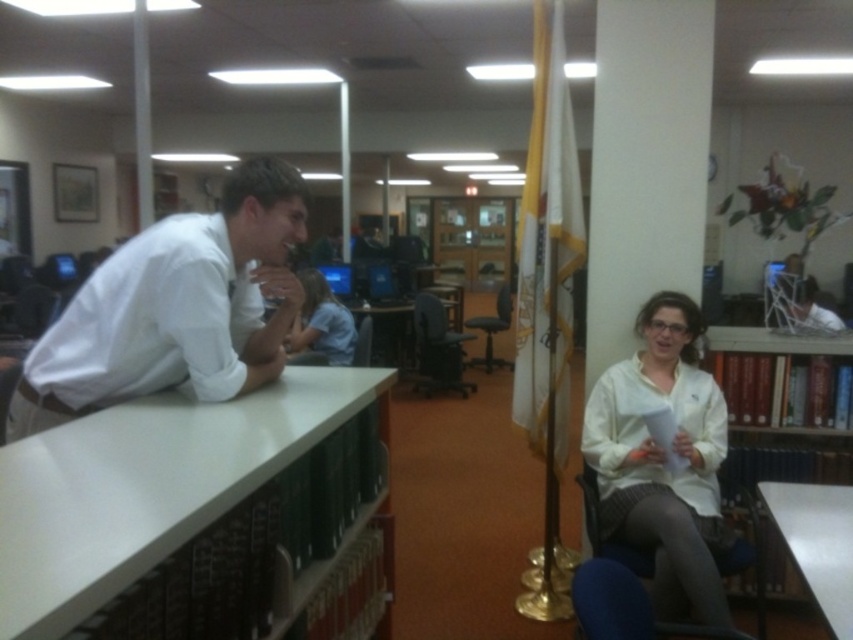
Locate an element on the screen. The width and height of the screenshot is (853, 640). white glossy table at lower right is located at coordinates (817, 544).

Describe the element at coordinates (817, 544) in the screenshot. The height and width of the screenshot is (640, 853). I see `white glossy table at lower right` at that location.

The image size is (853, 640). What do you see at coordinates (817, 544) in the screenshot?
I see `white glossy table at lower right` at bounding box center [817, 544].

Locate an element on the screen. white glossy table at lower right is located at coordinates (817, 544).

Where is `white glossy table at left`? white glossy table at left is located at coordinates pyautogui.click(x=146, y=486).

Is white glossy table at left above white smooth shirt at left?

No.

The height and width of the screenshot is (640, 853). I want to click on white glossy table at left, so click(146, 486).

Locate an element on the screen. This screenshot has height=640, width=853. white glossy table at left is located at coordinates (146, 486).

Consider the image. Who is higher up, white smooth shirt at left or white glossy table at lower right?

Positioned higher is white smooth shirt at left.

Looking at this image, measure the distance between white smooth shirt at left and white glossy table at lower right.

white smooth shirt at left and white glossy table at lower right are 1.48 meters apart from each other.

Is point (154, 312) closer to camera compared to point (830, 490)?

Yes.

You are a GUI agent. You are given a task and a screenshot of the screen. Output one action in this format:
    pyautogui.click(x=<x>, y=<y>)
    Task: Click on the white smooth shirt at left
    The height and width of the screenshot is (640, 853).
    Given the screenshot: What is the action you would take?
    pyautogui.click(x=177, y=307)